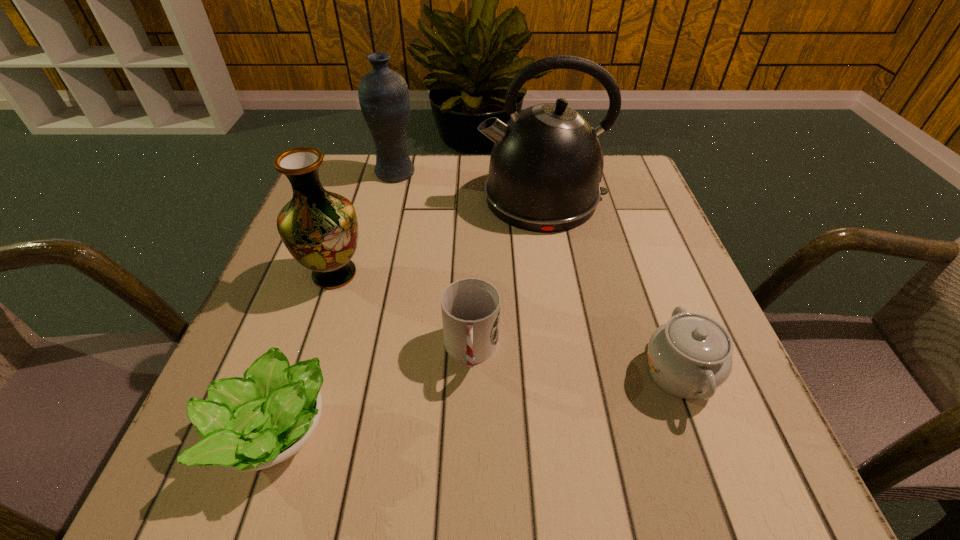
The height and width of the screenshot is (540, 960). Find the location of `free location located 0.200m on the right of the third farthest object`. free location located 0.200m on the right of the third farthest object is located at coordinates (468, 274).

Identify the location of free space located 0.050m on the back of the chinaware. Image resolution: width=960 pixels, height=540 pixels. (657, 312).

You are a GUI agent. You are given a task and a screenshot of the screen. Output one action in this format:
    pyautogui.click(x=<x>, y=<y>)
    Task: Click on the free space located 0.390m on the right of the lettuce
    The width and height of the screenshot is (960, 540).
    Given the screenshot: What is the action you would take?
    pyautogui.click(x=594, y=428)

The width and height of the screenshot is (960, 540). Identify the location of kettle present at the far edge. (546, 163).

This screenshot has height=540, width=960. In order to click on vase at the far edge in this screenshot , I will do `click(384, 98)`.

This screenshot has height=540, width=960. What are the coordinates of `object at the near edge` in the screenshot? It's located at (248, 424).

Identify the location of lettuce that is at the left edge. This screenshot has width=960, height=540. (248, 424).

Where is `kettle located in the right edge section of the desktop`? Image resolution: width=960 pixels, height=540 pixels. kettle located in the right edge section of the desktop is located at coordinates (546, 163).

Find the location of `chinaware positioned at the right edge`. chinaware positioned at the right edge is located at coordinates (690, 356).

You are a GUI agent. You are given a task and a screenshot of the screen. Output one action in this format:
    pyautogui.click(x=<x>, y=<y>)
    Task: Click on the object that is at the far left corner
    This screenshot has width=960, height=540.
    Given the screenshot: What is the action you would take?
    pyautogui.click(x=384, y=98)